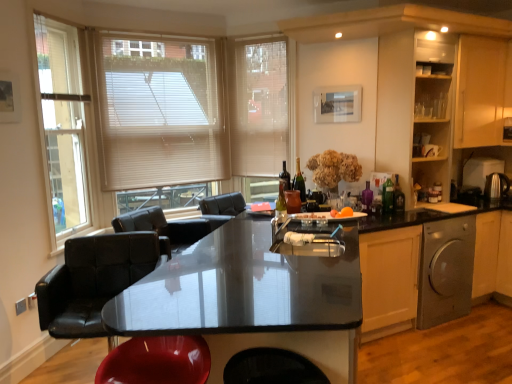
I want to click on vacant area on top of beige fabric blind at upper center (from a real-world perspective), so pyautogui.click(x=249, y=39).